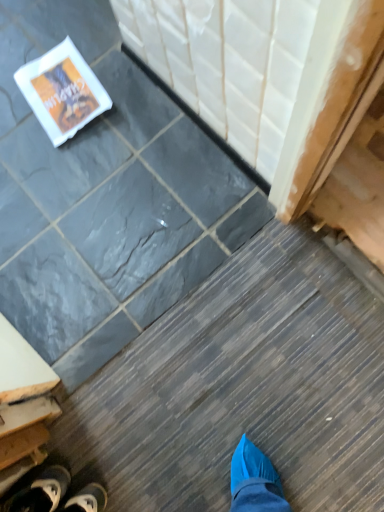
This screenshot has width=384, height=512. What are the coordinates of `empty space that is to the right of black canvas shoe at lower left` in the screenshot? It's located at (100, 449).